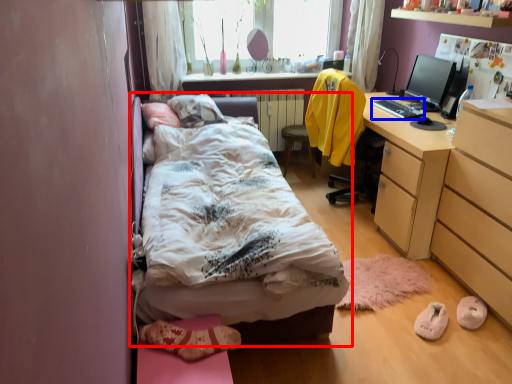
Question: Which of the following is the farthest to the observer, bed (highlighted by a red box) or desktop (highlighted by a blue box)?

Choices:
 (A) bed
 (B) desktop

Answer: (B)